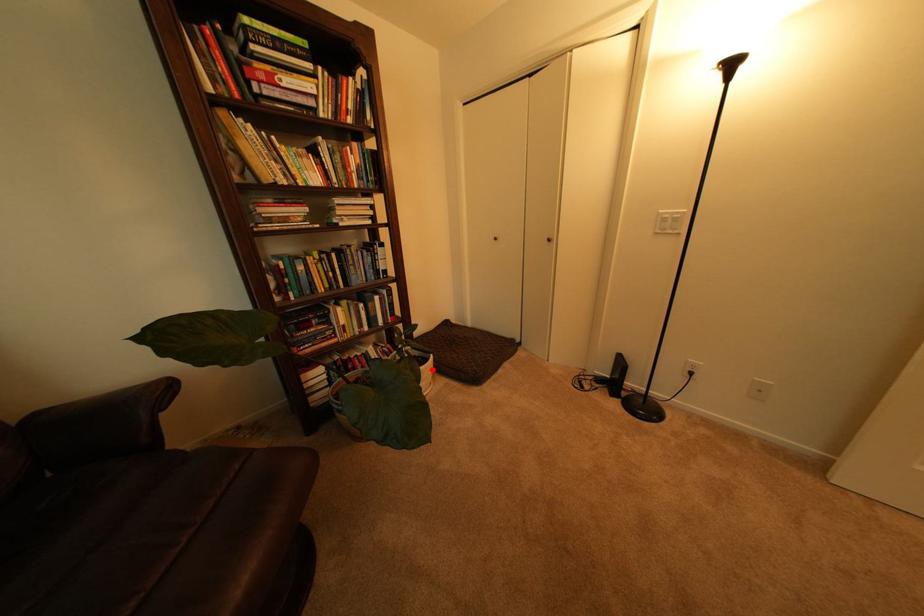
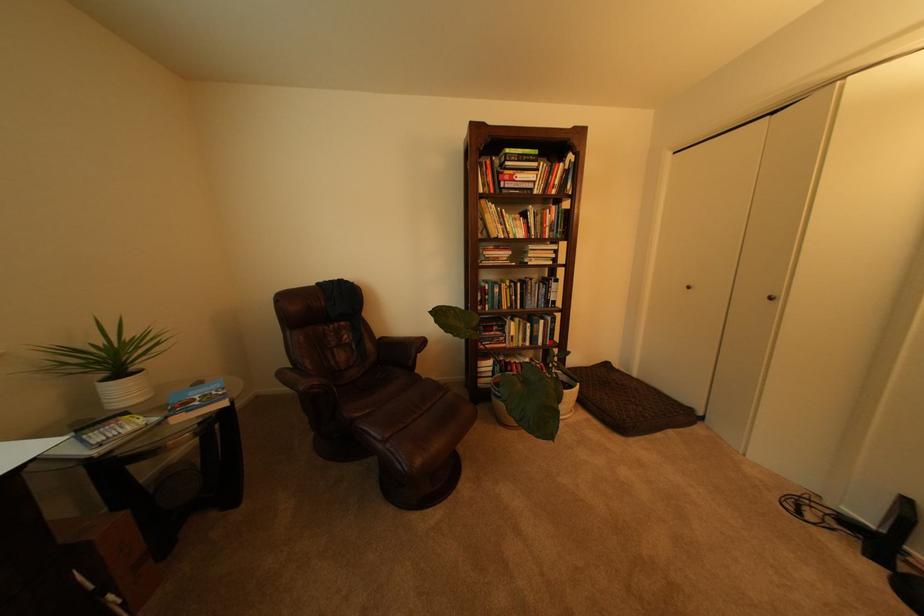
Locate, in the second image, the point that corresponds to the highlighted location in the first image.

(576, 392)